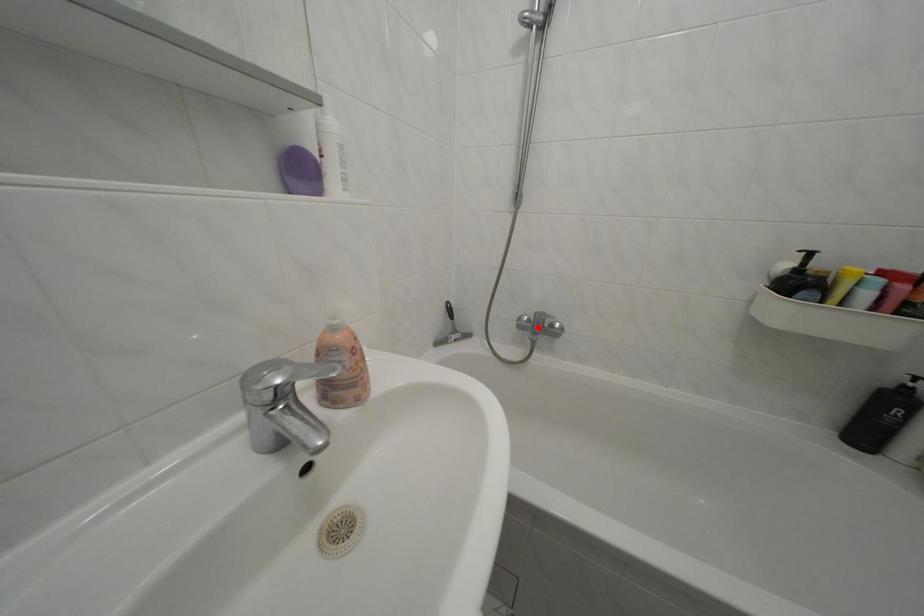
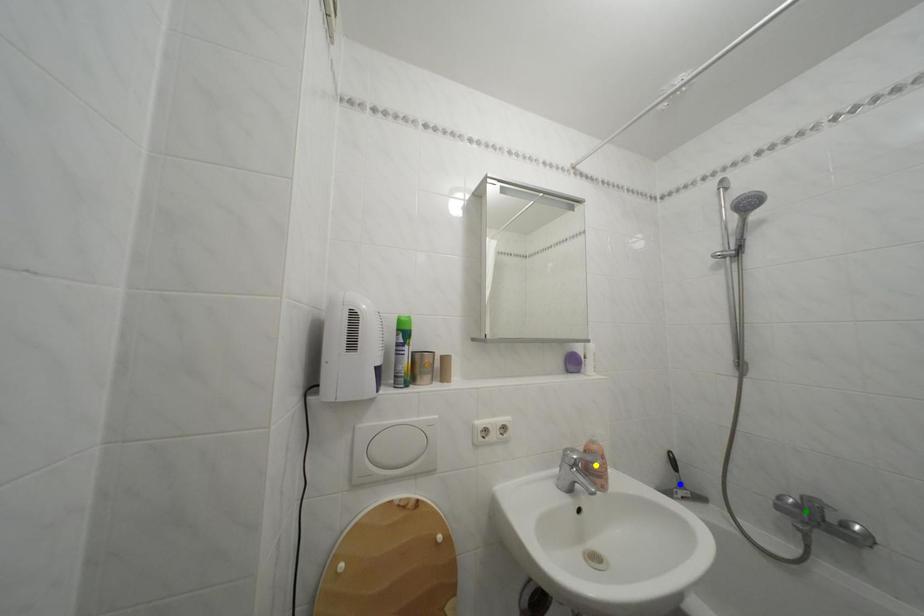
Question: I am providing you with two images of the same scene from different viewpoints. A red point is marked on the first image. You are given multiple points on the second image. Which mark in image 2 goes with the point in image 1?

Choices:
 (A) yellow point
 (B) green point
 (C) blue point

Answer: (B)